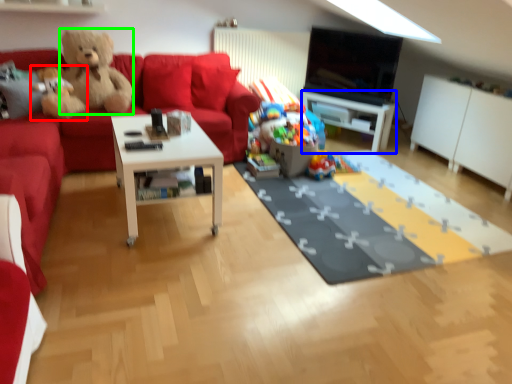
Question: Based on their relative distances, which object is farther from teddy bear (highlighted by a red box)? Choose from table (highlighted by a blue box) and teddy bear (highlighted by a green box).

Choices:
 (A) table
 (B) teddy bear

Answer: (A)